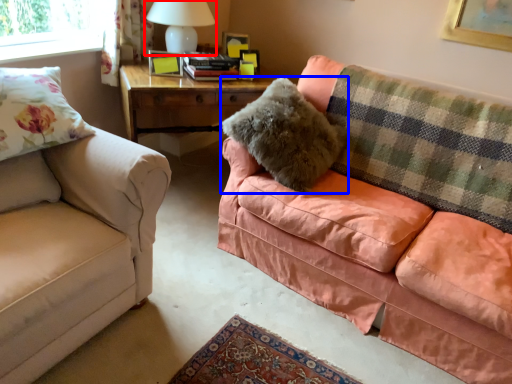
Question: Which point is further to the camera, table lamp (highlighted by a red box) or pillow (highlighted by a blue box)?

Choices:
 (A) table lamp
 (B) pillow

Answer: (A)